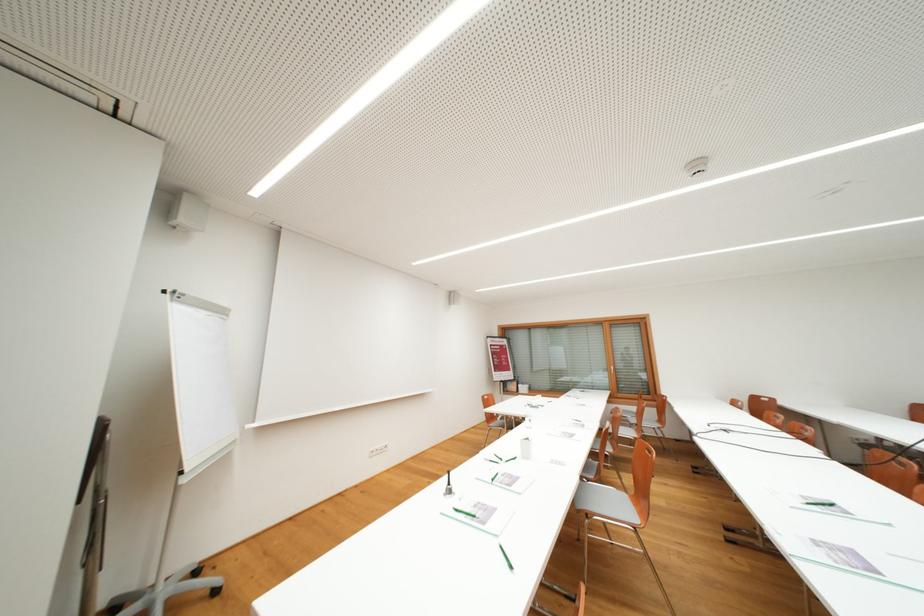
What do you see at coordinates (621, 509) in the screenshot? I see `a grey chair sitting surface` at bounding box center [621, 509].